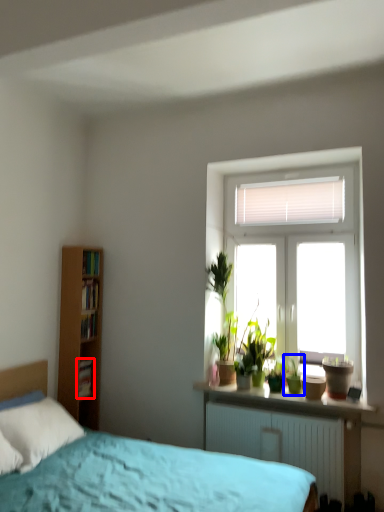
Question: Among these objects, which one is nearest to the camera, book (highlighted by a red box) or houseplant (highlighted by a blue box)?

Choices:
 (A) book
 (B) houseplant

Answer: (B)